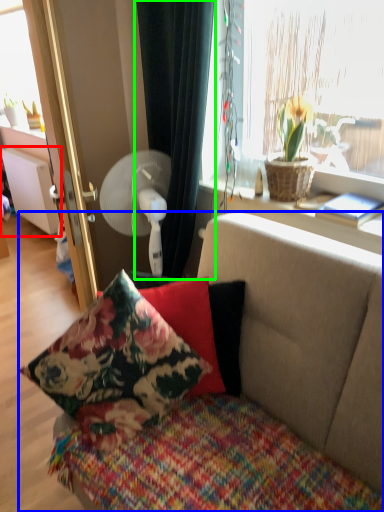
Question: Estimate the real-world distances between objects in this image. Which object is closer to radiator (highlighted by a red box), studio couch (highlighted by a blue box) or curtain (highlighted by a green box)?

Choices:
 (A) studio couch
 (B) curtain

Answer: (B)